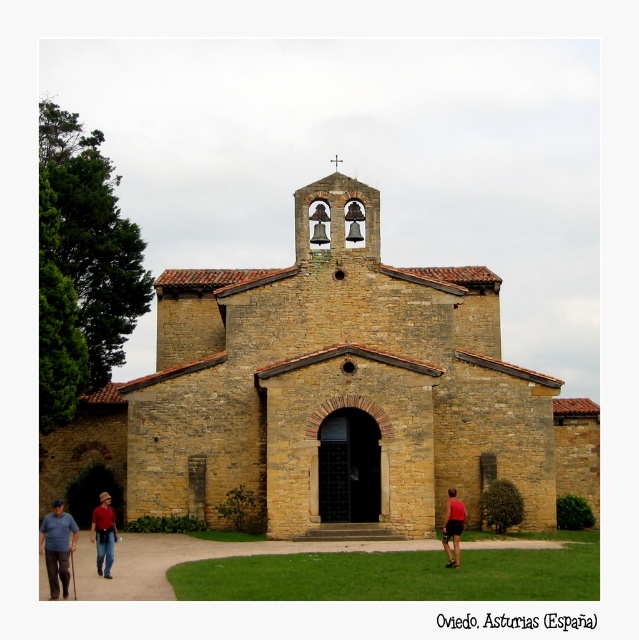
Question: Observing the image, what is the correct spatial positioning of blue shirt at lower left in reference to red shirt at lower left?

Choices:
 (A) below
 (B) above

Answer: (A)

Question: Can you confirm if red shirt at lower left is positioned to the left of red fabric shorts at lower right?

Choices:
 (A) yes
 (B) no

Answer: (A)

Question: Which object is positioned closest to the red shirt at lower left?

Choices:
 (A) yellow stone chapel at center
 (B) blue shirt at lower left

Answer: (B)

Question: Which object appears farthest from the camera in this image?

Choices:
 (A) red shirt at lower left
 (B) yellow stone chapel at center
 (C) blue shirt at lower left

Answer: (B)

Question: Can you confirm if yellow stone chapel at center is thinner than red fabric shorts at lower right?

Choices:
 (A) yes
 (B) no

Answer: (B)

Question: Based on their relative distances, which object is farther from the blue shirt at lower left?

Choices:
 (A) yellow stone chapel at center
 (B) red shirt at lower left

Answer: (A)